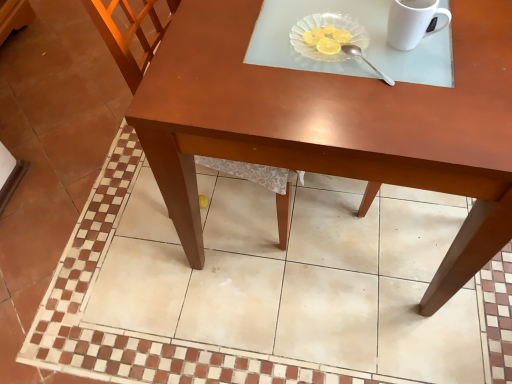
The height and width of the screenshot is (384, 512). In order to click on vacant space positioned to the left of silver metallic spoon at upper center in this screenshot , I will do `click(283, 67)`.